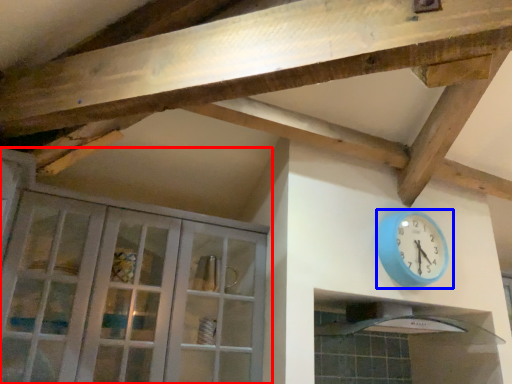
Question: Which point is further to the camera, cabinetry (highlighted by a red box) or wall clock (highlighted by a blue box)?

Choices:
 (A) cabinetry
 (B) wall clock

Answer: (B)